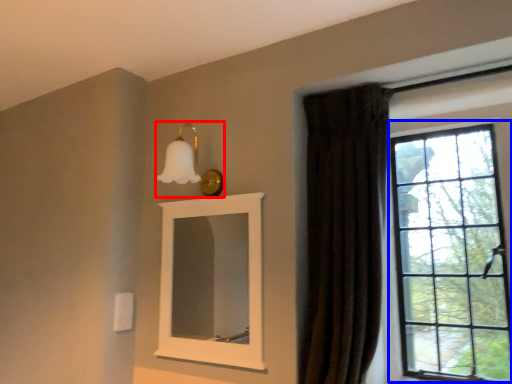
Question: Which object appears closest to the camera in this image, light fixture (highlighted by a red box) or window (highlighted by a blue box)?

Choices:
 (A) light fixture
 (B) window

Answer: (B)